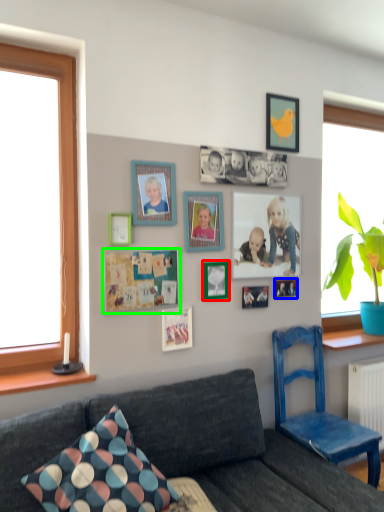
Question: Which object is positioned closest to picture frame (highlighted by a red box)? Select from picture frame (highlighted by a blue box) and bulletin board (highlighted by a green box).

Choices:
 (A) picture frame
 (B) bulletin board

Answer: (B)